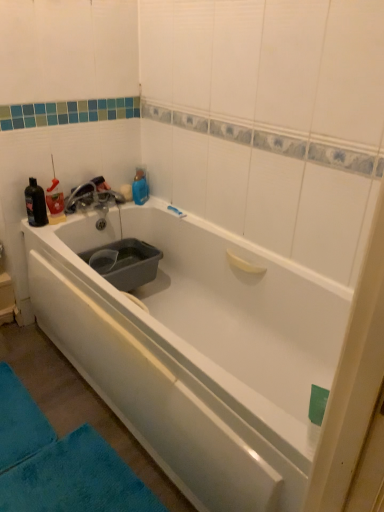
Question: From a real-world perspective, is gray plastic basin at left positioned above or below matte silver faucet at upper left?

Choices:
 (A) below
 (B) above

Answer: (A)

Question: In terms of height, does gray plastic basin at left look taller or shorter compared to matte silver faucet at upper left?

Choices:
 (A) short
 (B) tall

Answer: (B)

Question: Estimate the real-world distances between objects in this image. Which object is closer to the white glossy bathtub at center?

Choices:
 (A) gray plastic basin at left
 (B) translucent plastic bottle at upper left, arranged as the second bottle when viewed from the left
 (C) matte silver faucet at upper left
 (D) blue plush bath mat at lower left, the first bath mat viewed from the right
 (E) black matte bottle at upper left, positioned as the 2th bottle in right-to-left order

Answer: (A)

Question: Which of these objects is positioned farthest from the gray plastic basin at left?

Choices:
 (A) blue plush bath mat at lower left, marked as the 2th bath mat in a left-to-right arrangement
 (B) black matte bottle at upper left, placed as the 1th bottle when sorted from left to right
 (C) white glossy bathtub at center
 (D) blue soft bath mat at lower left, placed as the second bath mat when sorted from right to left
 (E) translucent plastic bottle at upper left, which ranks as the first bottle in right-to-left order

Answer: (A)